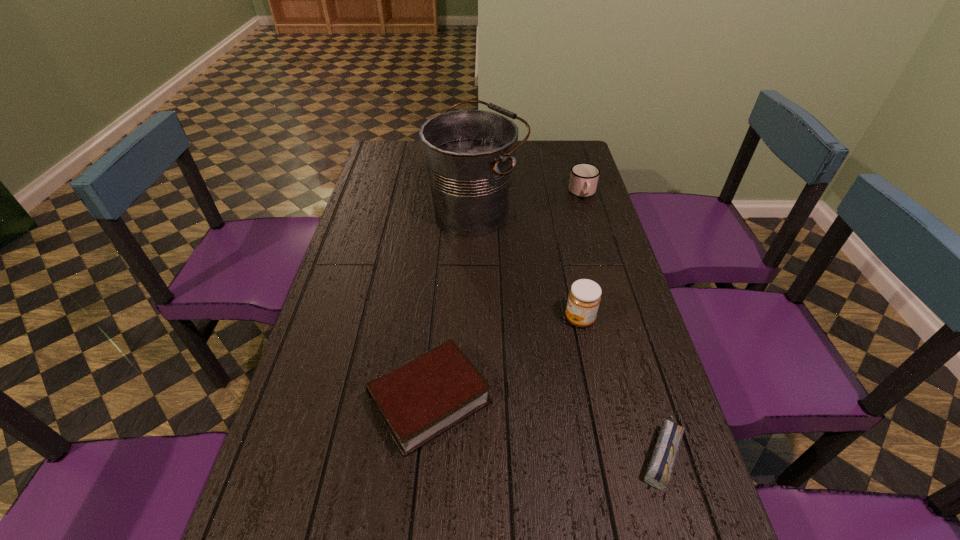
The image size is (960, 540). Find the location of `free space located 0.050m on the side of the third tallest object with the handle`. free space located 0.050m on the side of the third tallest object with the handle is located at coordinates (588, 211).

Where is `free spot located 0.300m on the right of the Bible`? free spot located 0.300m on the right of the Bible is located at coordinates (622, 400).

Where is `free space located 0.200m on the back of the shortest object`? The height and width of the screenshot is (540, 960). free space located 0.200m on the back of the shortest object is located at coordinates (629, 345).

Locate an element on the screen. jam at the right edge is located at coordinates (584, 298).

You are a GUI agent. You are given a task and a screenshot of the screen. Output one action in this format:
    pyautogui.click(x=<x>, y=<y>)
    Task: Click on the mug present at the right edge
    This screenshot has height=540, width=960.
    Given the screenshot: What is the action you would take?
    pyautogui.click(x=584, y=177)

The image size is (960, 540). In order to click on pencil box present at the right edge in this screenshot , I will do `click(659, 470)`.

Locate an element on the screen. Image resolution: width=960 pixels, height=540 pixels. vacant area at the far edge is located at coordinates (522, 168).

Where is `free location at the left edge`? Image resolution: width=960 pixels, height=540 pixels. free location at the left edge is located at coordinates (350, 324).

Identify the location of blank space at the right edge of the desktop. (586, 332).

Where is `vacant space at the far left corner of the desktop`? vacant space at the far left corner of the desktop is located at coordinates (372, 166).